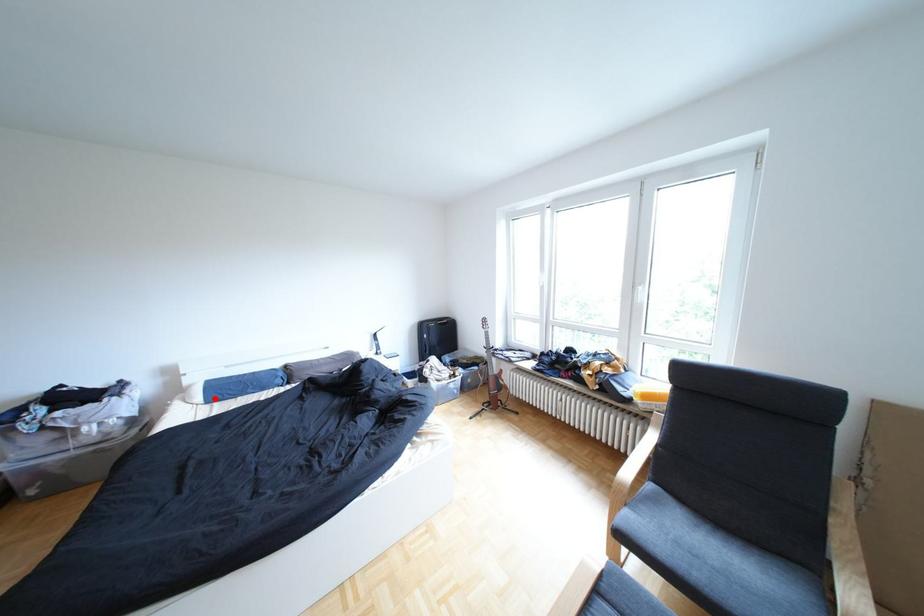
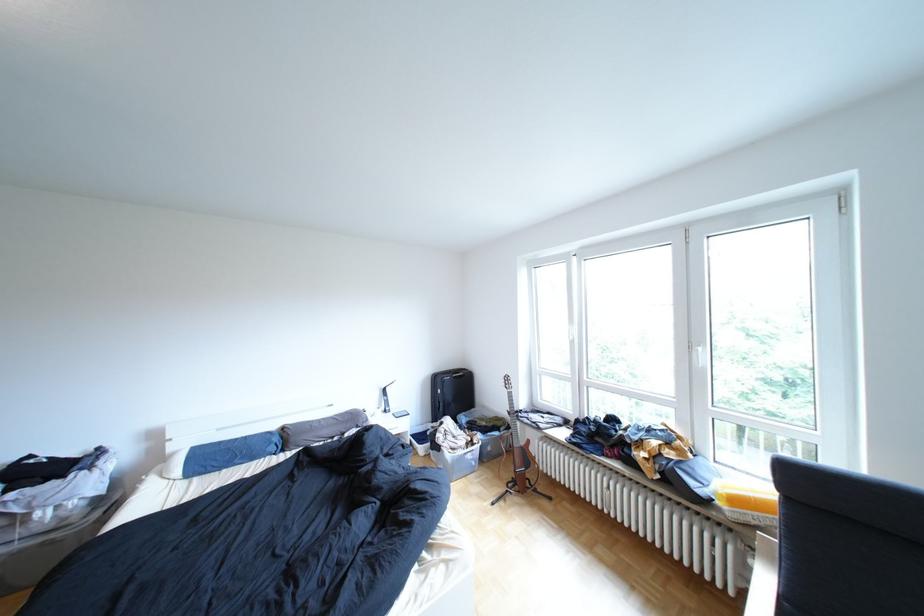
Where in the second image is the point corresponding to the highlighted location from the first image?

(193, 472)